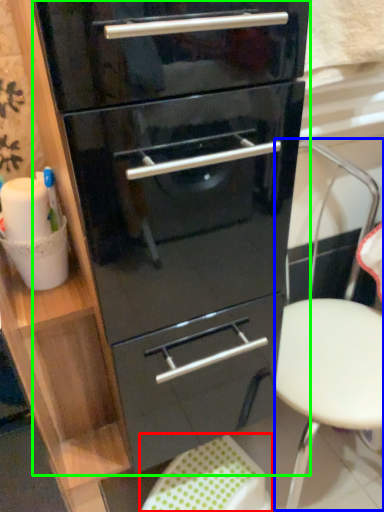
Question: Which is nearer to the step stool (highlighted by a red box)? folding chair (highlighted by a blue box) or chest of drawers (highlighted by a green box).

Choices:
 (A) folding chair
 (B) chest of drawers

Answer: (A)